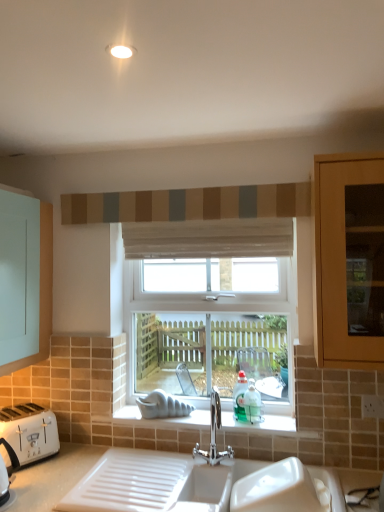
Identify the location of vacant area situated to the left side of polished chrome tap at center. (167, 463).